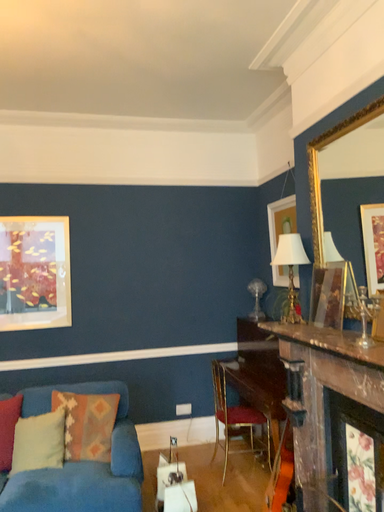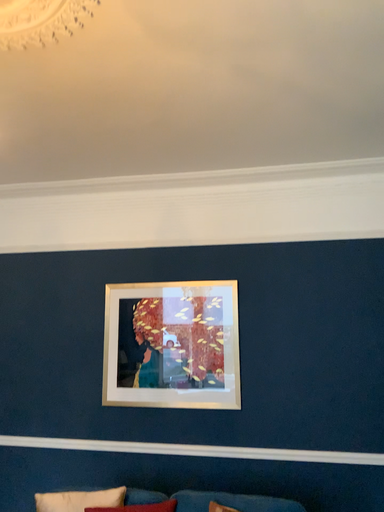
Question: Which way did the camera rotate in the video?

Choices:
 (A) rotated downward
 (B) rotated upward

Answer: (B)